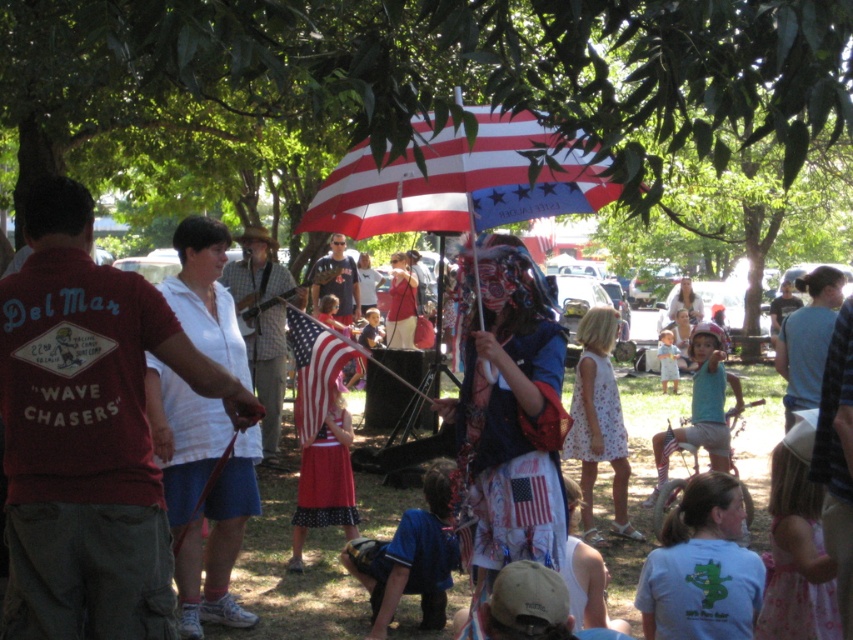
Question: Which is nearer to the red fabric skirt at center?

Choices:
 (A) white cotton t-shirt at lower right
 (B) blue cotton shirt at lower center
 (C) white floral dress at center
 (D) reddish-brown cotton shirt at center

Answer: (B)

Question: Which point is closer to the camera?

Choices:
 (A) (340, 560)
 (B) (582, 490)

Answer: (A)

Question: Can you confirm if blue cotton shirt at lower center is thinner than american flag at center?

Choices:
 (A) no
 (B) yes

Answer: (A)

Question: Which object is closer to the camera taking this photo?

Choices:
 (A) reddish-brown cotton shirt at center
 (B) white cotton t-shirt at lower right

Answer: (A)

Question: From the image, what is the correct spatial relationship of reddish-brown cotton shirt at center in relation to white floral dress at center?

Choices:
 (A) right
 (B) left

Answer: (B)

Question: Is light blue cotton shorts at center positioned before american flag at center?

Choices:
 (A) yes
 (B) no

Answer: (B)